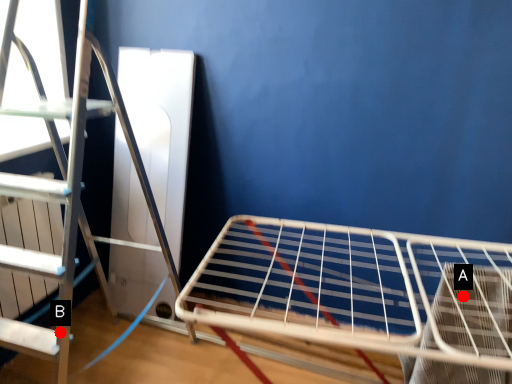
Question: Two points are circled on the image, labeled by A and B beside each circle. Which point is farther to the camera?

Choices:
 (A) A is further
 (B) B is further

Answer: (B)